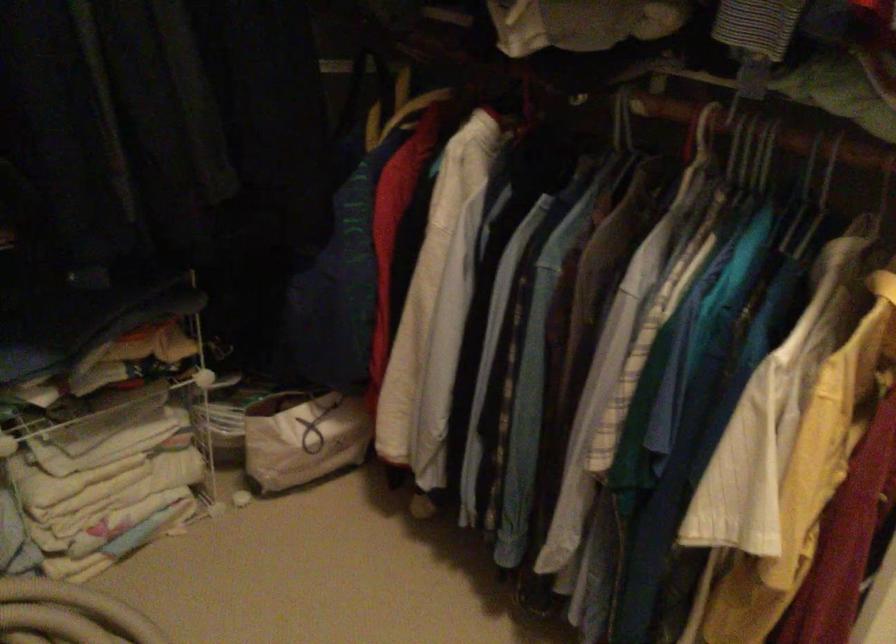
You are a GUI agent. You are given a task and a screenshot of the screen. Output one action in this format:
    pyautogui.click(x=<x>, y=<y>)
    Task: Click on the white bag handle
    The width and height of the screenshot is (896, 644).
    Given the screenshot: What is the action you would take?
    pyautogui.click(x=314, y=430)